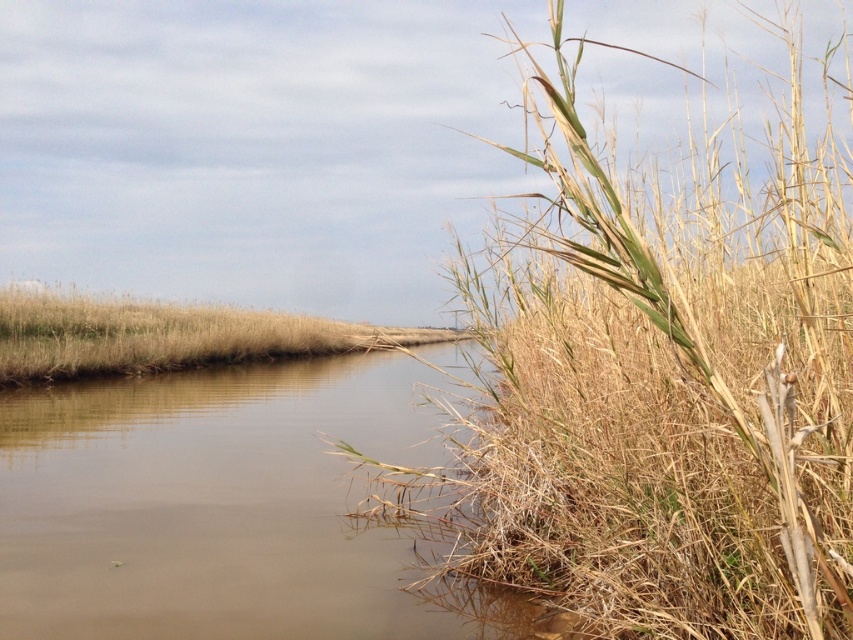
Question: Where is brown muddy water at center located in relation to dry grass at center in the image?

Choices:
 (A) below
 (B) above

Answer: (A)

Question: Considering the relative positions of brown muddy water at center and dry grass at center in the image provided, where is brown muddy water at center located with respect to dry grass at center?

Choices:
 (A) right
 (B) left

Answer: (A)

Question: Does brown muddy water at center have a smaller size compared to dry grass at center?

Choices:
 (A) yes
 (B) no

Answer: (A)

Question: Among these points, which one is nearest to the camera?

Choices:
 (A) (343, 372)
 (B) (422, 340)

Answer: (A)